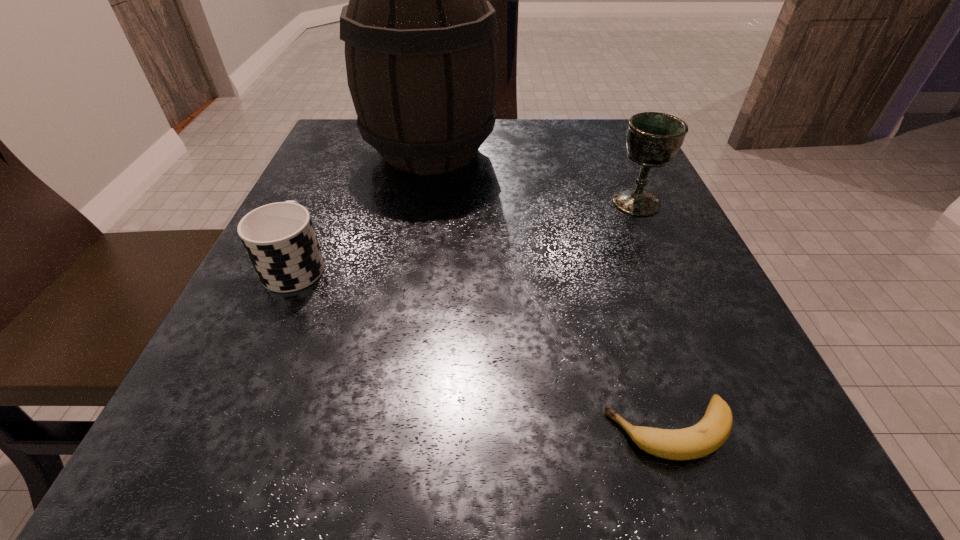
Select which object is the closest to the cup. Please provide its 2D coordinates. Your answer should be formatted as a tuple, i.e. [(x, y)], where the tuple contains the x and y coordinates of a point satisfying the conditions above.

[(421, 58)]

Locate an element on the screen. The width and height of the screenshot is (960, 540). vacant space that satisfies the following two spatial constraints: 1. on the side of the second tallest object with the handle; 2. on the right side of the third tallest object is located at coordinates pyautogui.click(x=324, y=202).

Where is `vacant point that satisfies the following two spatial constraints: 1. on the side of the farthest object with the handle; 2. on the left side of the second nearest object`? vacant point that satisfies the following two spatial constraints: 1. on the side of the farthest object with the handle; 2. on the left side of the second nearest object is located at coordinates (347, 151).

Image resolution: width=960 pixels, height=540 pixels. What are the coordinates of `free space that satisfies the following two spatial constraints: 1. on the side of the second shortest object with the handle; 2. on the left side of the wine bucket` in the screenshot? It's located at (347, 151).